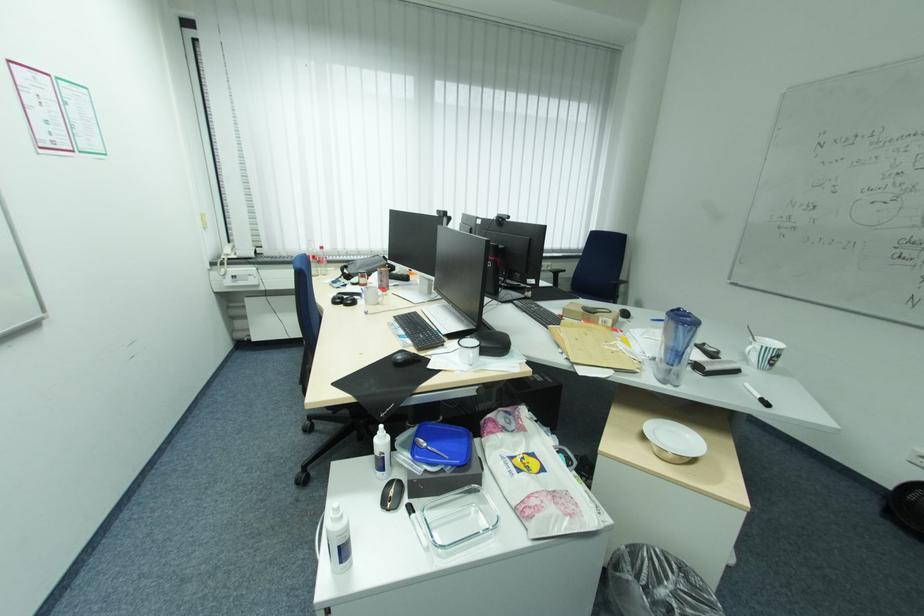
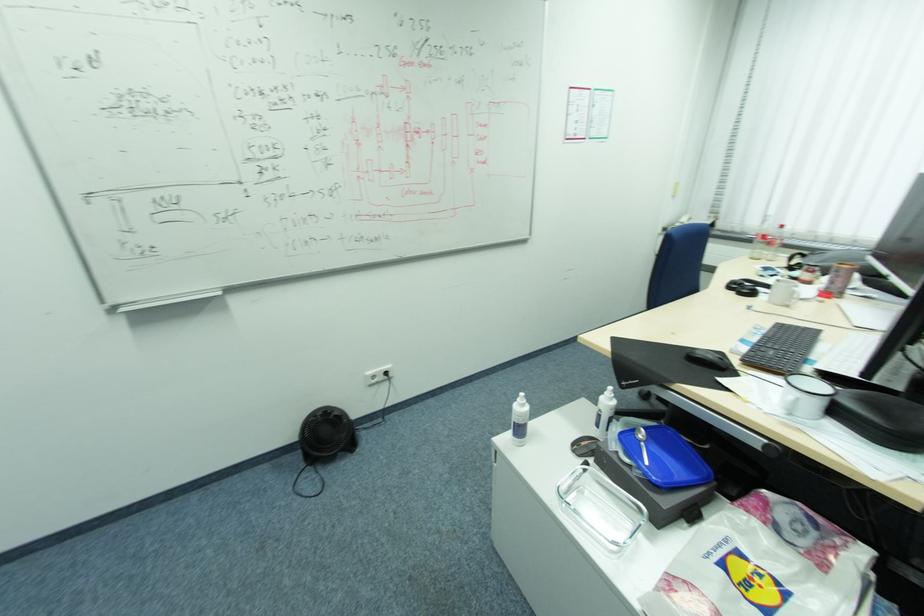
First-person continuous shooting, in which direction is the camera rotating?

The rotation direction of the camera is left-down.